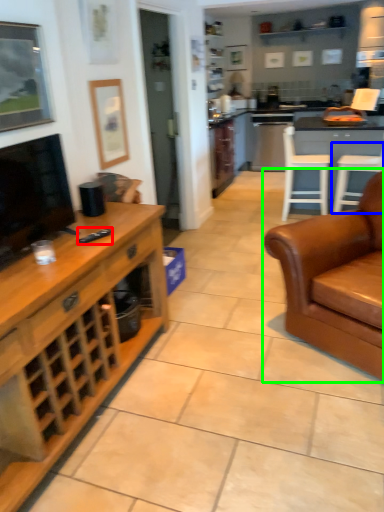
Question: Which object is the closest to the remote (highlighted by a red box)? Choose among these: chair (highlighted by a blue box) or studio couch (highlighted by a green box).

Choices:
 (A) chair
 (B) studio couch

Answer: (B)